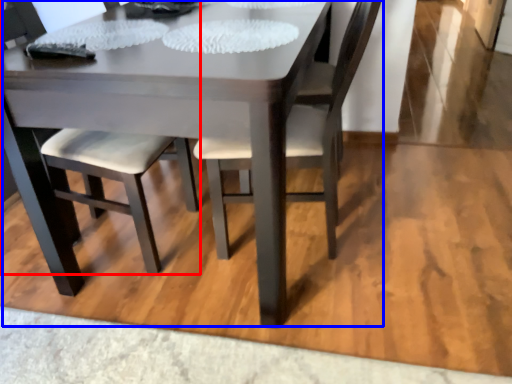
Question: Among these objects, which one is nearest to the camera, chair (highlighted by a red box) or kitchen & dining room table (highlighted by a blue box)?

Choices:
 (A) chair
 (B) kitchen & dining room table

Answer: (B)